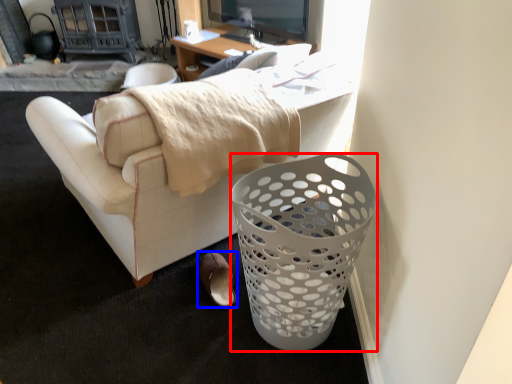
Question: Which point is closer to the camera, trash bin/can (highlighted by a red box) or footwear (highlighted by a blue box)?

Choices:
 (A) trash bin/can
 (B) footwear

Answer: (A)